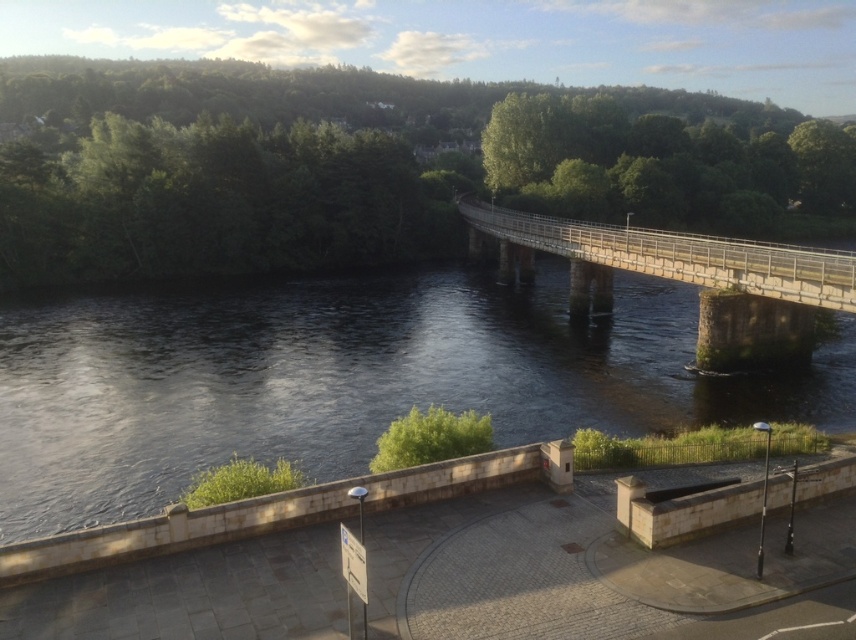
Question: Which point appears closest to the camera in this image?

Choices:
 (A) (210, 308)
 (B) (642, 241)

Answer: (B)

Question: Among these points, which one is nearest to the camera?

Choices:
 (A) (640, 250)
 (B) (366, 326)

Answer: (A)

Question: Which of the following is the closest to the observer?

Choices:
 (A) (227, 378)
 (B) (770, 262)

Answer: (B)

Question: Observing the image, what is the correct spatial positioning of dark water at center in reference to stone bridge at center?

Choices:
 (A) above
 (B) below

Answer: (B)

Question: Observing the image, what is the correct spatial positioning of dark water at center in reference to stone bridge at center?

Choices:
 (A) above
 (B) below

Answer: (B)

Question: Is dark water at center further to camera compared to stone bridge at center?

Choices:
 (A) no
 (B) yes

Answer: (A)